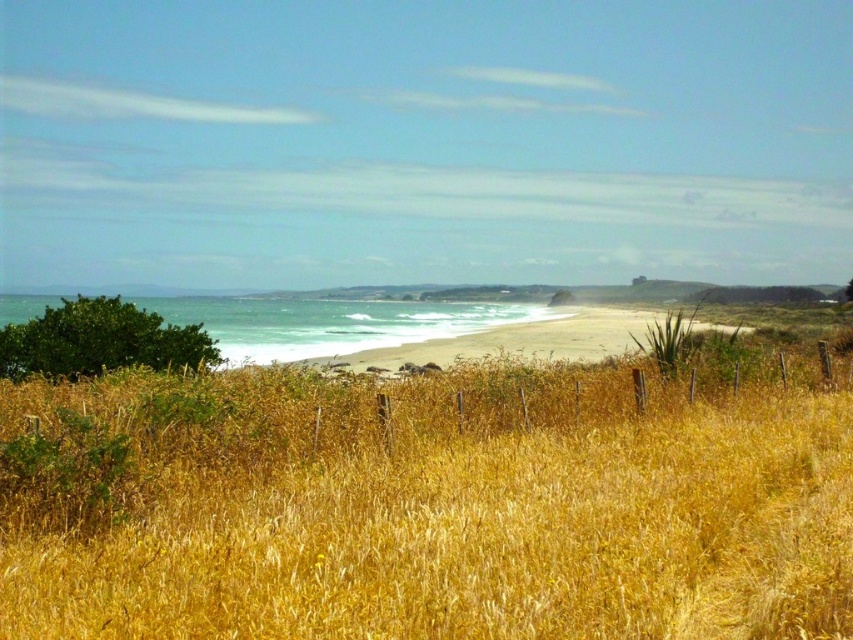
Does dry golden grass at center appear over white sandy beach at center?

No.

Can you confirm if dry golden grass at center is thinner than white sandy beach at center?

Yes.

This screenshot has height=640, width=853. Describe the element at coordinates (450, 508) in the screenshot. I see `dry golden grass at center` at that location.

You are a GUI agent. You are given a task and a screenshot of the screen. Output one action in this format:
    pyautogui.click(x=<x>, y=<y>)
    Task: Click on the dry golden grass at center
    This screenshot has height=640, width=853.
    Given the screenshot: What is the action you would take?
    pyautogui.click(x=450, y=508)